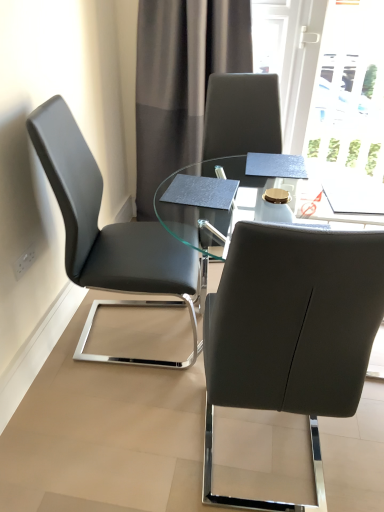
Where is `vacant region in front of matte black chair at left, arranged as the 2th chair when viewed from the right`? The width and height of the screenshot is (384, 512). vacant region in front of matte black chair at left, arranged as the 2th chair when viewed from the right is located at coordinates (103, 421).